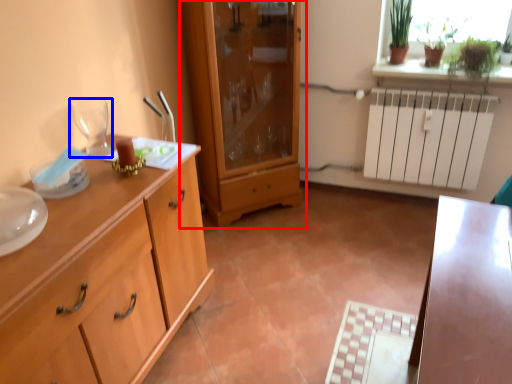
Question: Which object appears closest to the camera in this image, cupboard (highlighted by a red box) or wine glass (highlighted by a blue box)?

Choices:
 (A) cupboard
 (B) wine glass

Answer: (B)